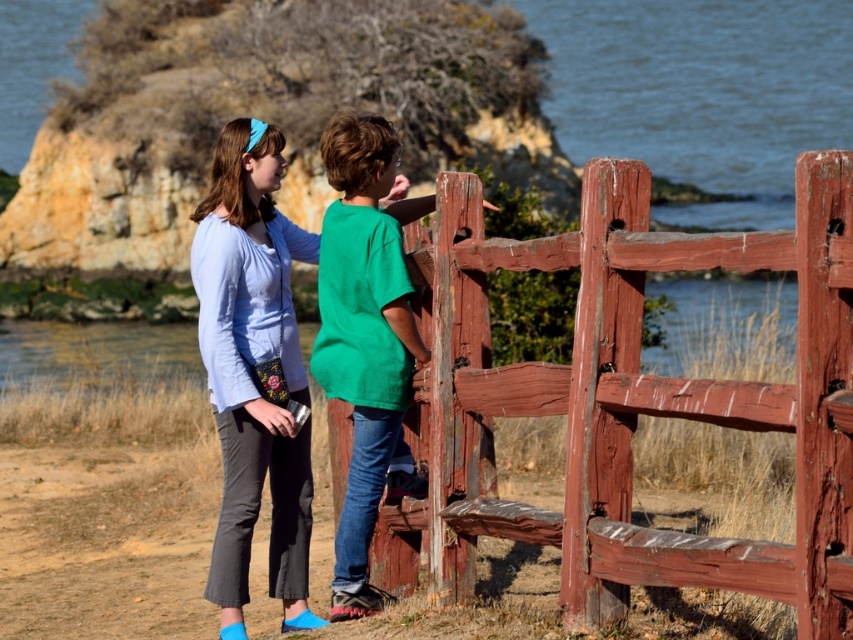
Is point (756, 60) closer to camera compared to point (378, 337)?

No.

Is point (700, 314) farther from viewer compared to point (415, 339)?

Yes, it is.

Image resolution: width=853 pixels, height=640 pixels. Find the location of `smooth water at upper center`. smooth water at upper center is located at coordinates (701, 93).

Which is below, rustic wooden fence at center or matte blue shirt at center?

matte blue shirt at center is below.

Does rustic wooden fence at center appear under matte blue shirt at center?

No.

Does point (692, 246) come closer to viewer compared to point (285, 480)?

Yes, it is.

Identify the location of rustic wooden fence at center. (660, 396).

Is rustic wooden fence at center taller than green matte shirt at center?

Incorrect, rustic wooden fence at center's height is not larger of green matte shirt at center's.

Between rustic wooden fence at center and green matte shirt at center, which one has more height?

green matte shirt at center

This screenshot has width=853, height=640. Describe the element at coordinates (660, 396) in the screenshot. I see `rustic wooden fence at center` at that location.

Image resolution: width=853 pixels, height=640 pixels. What are the coordinates of `rustic wooden fence at center` in the screenshot? It's located at (660, 396).